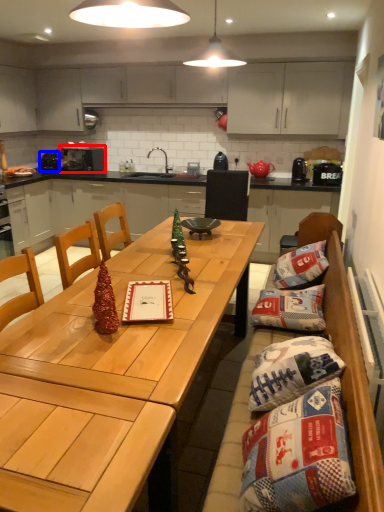
Question: Which point is further to the camera, appliance (highlighted by a red box) or appliance (highlighted by a blue box)?

Choices:
 (A) appliance
 (B) appliance

Answer: (B)